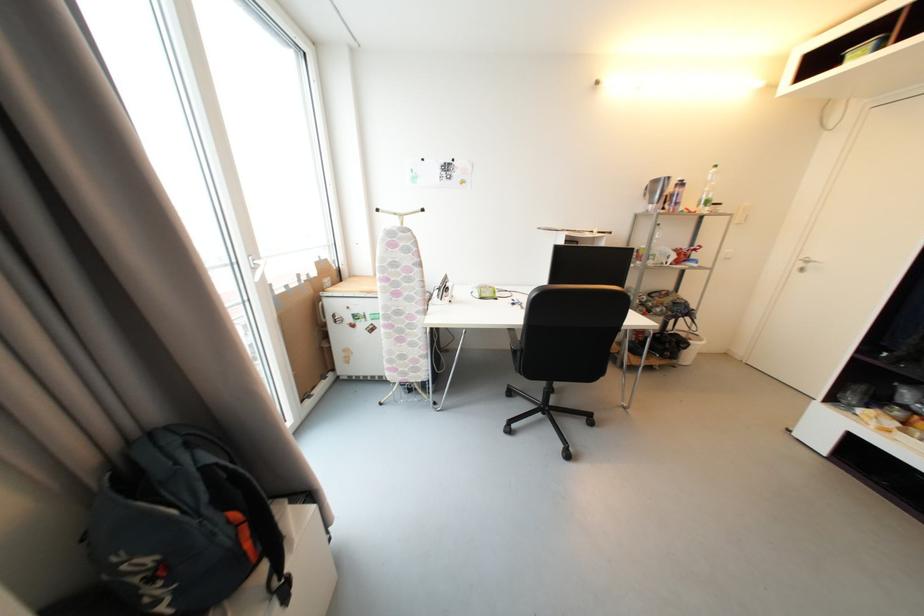
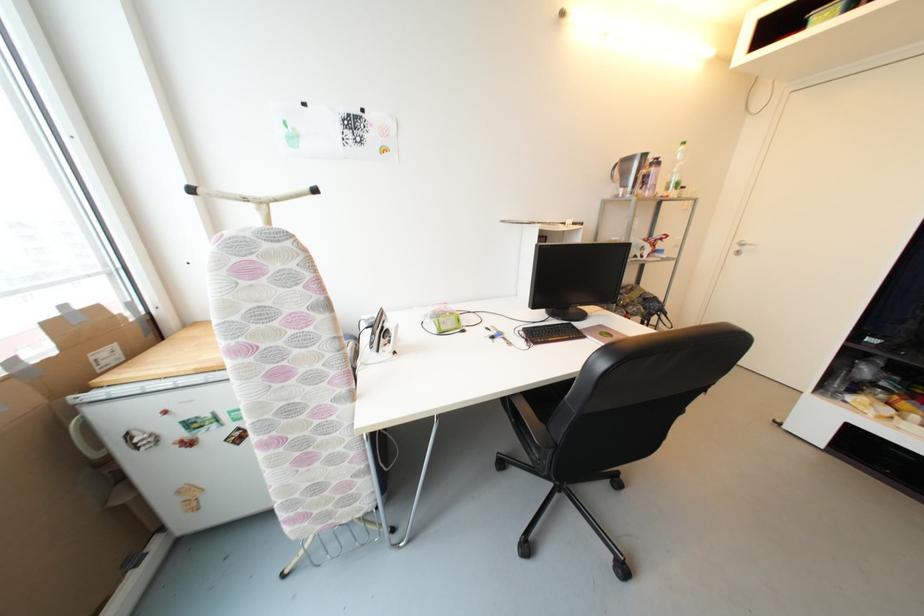
Find the pixel in the second image that matches pixel 806 267 in the first image.

(742, 249)